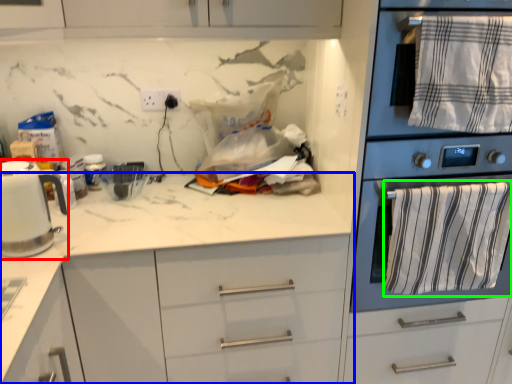
Question: Estimate the real-world distances between objects in this image. Which object is closer to kitchen appliance (highlighted by a red box), countertop (highlighted by a blue box) or bath towel (highlighted by a green box)?

Choices:
 (A) countertop
 (B) bath towel

Answer: (A)